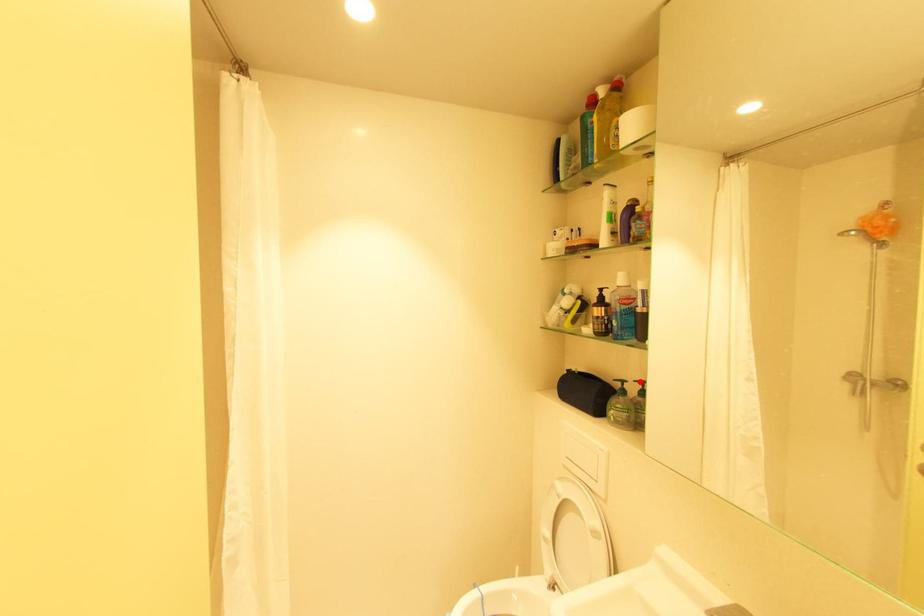
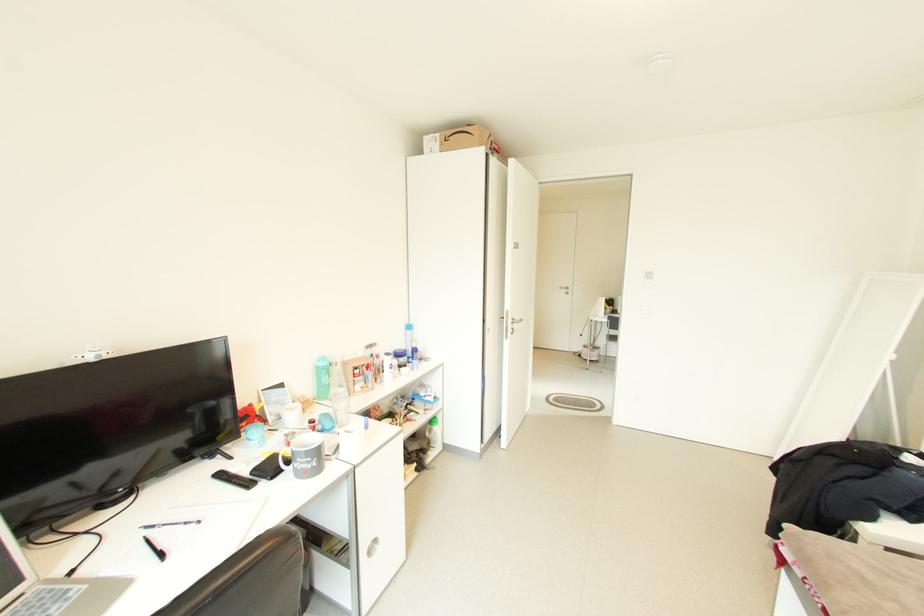
Question: I am providing you with two images of the same scene from different viewpoints. A red point is marked on the first image. Can you still see the location of the red point in image 2?

Choices:
 (A) Yes
 (B) No

Answer: (B)